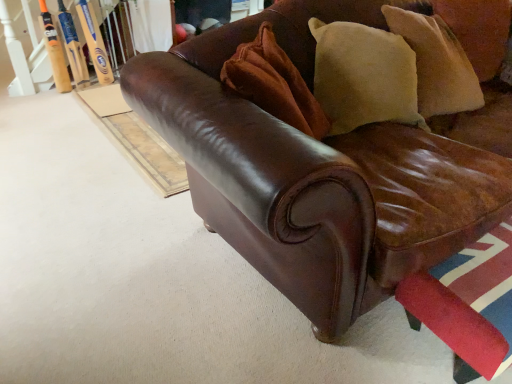
This screenshot has width=512, height=384. What do you see at coordinates (315, 173) in the screenshot?
I see `brown leather couch at center` at bounding box center [315, 173].

What is the approximate width of wooden baseball bat at upper left, the 2th baseball bat when ordered from left to right?

wooden baseball bat at upper left, the 2th baseball bat when ordered from left to right, is 5.60 inches wide.

What is the approximate height of orange wood baseball bat at upper left, the first baseball bat when ordered from left to right?

It is 26.14 inches.

The height and width of the screenshot is (384, 512). Describe the element at coordinates (55, 51) in the screenshot. I see `orange wood baseball bat at upper left, the first baseball bat when ordered from left to right` at that location.

You are a GUI agent. You are given a task and a screenshot of the screen. Output one action in this format:
    pyautogui.click(x=<x>, y=<y>)
    Task: Click on the brown leather couch at center
    Image resolution: width=512 pixels, height=384 pixels.
    Given the screenshot: What is the action you would take?
    pyautogui.click(x=315, y=173)

Is velvet beige pillow at upper right, placed as the second pillow when sorted from back to front, not close to brown leather couch at center?

velvet beige pillow at upper right, placed as the second pillow when sorted from back to front, is near brown leather couch at center, not far away.

Choose the correct answer: Is velvet beige pillow at upper right, marked as the second pillow in a right-to-left arrangement, inside brown leather couch at center or outside it?

velvet beige pillow at upper right, marked as the second pillow in a right-to-left arrangement, can be found inside brown leather couch at center.

Considering the positions of points (319, 115) and (386, 150), is point (319, 115) closer to camera compared to point (386, 150)?

No, (319, 115) is behind (386, 150).

From a real-world perspective, which object rests below the other?

From a 3D spatial view, brown leather couch at center is below.

Considering the sizes of objects rubberized red swivel chair at lower right and beige suede pillow at upper right, the second pillow when ordered from left to right, in the image provided, who is shorter, rubberized red swivel chair at lower right or beige suede pillow at upper right, the second pillow when ordered from left to right,?

Standing shorter between the two is rubberized red swivel chair at lower right.

Considering the relative positions of rubberized red swivel chair at lower right and beige suede pillow at upper right, the second pillow when ordered from left to right, in the image provided, is rubberized red swivel chair at lower right to the right of beige suede pillow at upper right, the second pillow when ordered from left to right, from the viewer's perspective?

No, rubberized red swivel chair at lower right is not to the right of beige suede pillow at upper right, the second pillow when ordered from left to right.

Does rubberized red swivel chair at lower right touch beige suede pillow at upper right, the second pillow when ordered from left to right?

No, rubberized red swivel chair at lower right is not next to beige suede pillow at upper right, the second pillow when ordered from left to right.

Is rubberized red swivel chair at lower right positioned beyond the bounds of beige suede pillow at upper right, which ranks as the 2th pillow in front-to-back order?

Absolutely, rubberized red swivel chair at lower right is external to beige suede pillow at upper right, which ranks as the 2th pillow in front-to-back order.

Does velvet beige pillow at upper right, placed as the second pillow when sorted from back to front, contain wooden baseball bat at upper left, the 2th baseball bat when ordered from left to right?

That's incorrect, wooden baseball bat at upper left, the 2th baseball bat when ordered from left to right, is not inside velvet beige pillow at upper right, placed as the second pillow when sorted from back to front.

Can you confirm if velvet beige pillow at upper right, placed as the second pillow when sorted from back to front, is bigger than wooden baseball bat at upper left, which is the first baseball bat from right to left?

Indeed, velvet beige pillow at upper right, placed as the second pillow when sorted from back to front, has a larger size compared to wooden baseball bat at upper left, which is the first baseball bat from right to left.

Is point (311, 100) behind point (82, 9)?

No, it is not.

Measure the distance from velvet beige pillow at upper right, arranged as the 1th pillow when viewed from the left, to wooden baseball bat at upper left, which is the first baseball bat from right to left.

velvet beige pillow at upper right, arranged as the 1th pillow when viewed from the left, and wooden baseball bat at upper left, which is the first baseball bat from right to left, are 6.95 feet apart from each other.

Who is smaller, wooden baseball bat at upper left, which is the first baseball bat from right to left, or velvet beige pillow at upper right, marked as the second pillow in a right-to-left arrangement?

wooden baseball bat at upper left, which is the first baseball bat from right to left, is smaller.

Which object is positioned more to the left, wooden baseball bat at upper left, the 2th baseball bat when ordered from left to right, or velvet beige pillow at upper right, placed as the second pillow when sorted from back to front?

Positioned to the left is wooden baseball bat at upper left, the 2th baseball bat when ordered from left to right.

Does wooden baseball bat at upper left, the 2th baseball bat when ordered from left to right, have a greater height compared to velvet beige pillow at upper right, marked as the second pillow in a right-to-left arrangement?

Yes.

Which object is further away from the camera taking this photo, wooden baseball bat at upper left, which is the first baseball bat from right to left, or velvet beige pillow at upper right, the 1th pillow when ordered from front to back?

Positioned behind is wooden baseball bat at upper left, which is the first baseball bat from right to left.

Considering the relative sizes of brown leather couch at center and rubberized red swivel chair at lower right in the image provided, is brown leather couch at center bigger than rubberized red swivel chair at lower right?

Yes.

This screenshot has width=512, height=384. Identify the location of swivel chair located behind the brown leather couch at center. (468, 304).

Which of these two, brown leather couch at center or rubberized red swivel chair at lower right, is thinner?

With smaller width is rubberized red swivel chair at lower right.

Based on the photo, how much distance is there between rubberized red swivel chair at lower right and orange wood baseball bat at upper left, the first baseball bat when ordered from left to right?

The distance of rubberized red swivel chair at lower right from orange wood baseball bat at upper left, the first baseball bat when ordered from left to right, is 9.52 feet.

From a real-world perspective, is rubberized red swivel chair at lower right physically located above or below orange wood baseball bat at upper left, the first baseball bat when ordered from left to right?

rubberized red swivel chair at lower right is below orange wood baseball bat at upper left, the first baseball bat when ordered from left to right.

Is rubberized red swivel chair at lower right positioned before orange wood baseball bat at upper left, the 2th baseball bat from the right?

Yes.

Between orange wood baseball bat at upper left, the first baseball bat when ordered from left to right, and rubberized red swivel chair at lower right, which one appears on the right side from the viewer's perspective?

rubberized red swivel chair at lower right.

In the scene shown: Can you confirm if orange wood baseball bat at upper left, the 2th baseball bat from the right, is shorter than rubberized red swivel chair at lower right?

Incorrect, the height of orange wood baseball bat at upper left, the 2th baseball bat from the right, does not fall short of that of rubberized red swivel chair at lower right.

Considering the sizes of orange wood baseball bat at upper left, the first baseball bat when ordered from left to right, and rubberized red swivel chair at lower right in the image, is orange wood baseball bat at upper left, the first baseball bat when ordered from left to right, wider or thinner than rubberized red swivel chair at lower right?

In the image, orange wood baseball bat at upper left, the first baseball bat when ordered from left to right, appears to be more narrow than rubberized red swivel chair at lower right.

Where is `swivel chair that appears in front of the orange wood baseball bat at upper left, the first baseball bat when ordered from left to right`? Image resolution: width=512 pixels, height=384 pixels. swivel chair that appears in front of the orange wood baseball bat at upper left, the first baseball bat when ordered from left to right is located at coordinates (468, 304).

Locate an element on the screen. The image size is (512, 384). studio couch above the velvet beige pillow at upper right, arranged as the 1th pillow when viewed from the left (from the image's perspective) is located at coordinates (315, 173).

Where is `swivel chair located in front of the beige suede pillow at upper right, which appears as the 1th pillow when viewed from the back`? The height and width of the screenshot is (384, 512). swivel chair located in front of the beige suede pillow at upper right, which appears as the 1th pillow when viewed from the back is located at coordinates (468, 304).

Looking at the image, which one is located further to wooden baseball bat at upper left, which is the first baseball bat from right to left, rubberized red swivel chair at lower right or beige suede pillow at upper right, the second pillow when ordered from left to right?

rubberized red swivel chair at lower right lies further to wooden baseball bat at upper left, which is the first baseball bat from right to left, than the other object.

Based on their spatial positions, is rubberized red swivel chair at lower right or wooden baseball bat at upper left, which is the first baseball bat from right to left, closer to brown leather couch at center?

Based on the image, rubberized red swivel chair at lower right appears to be nearer to brown leather couch at center.

Looking at the image, which one is located closer to beige suede pillow at upper right, positioned as the first pillow in right-to-left order, rubberized red swivel chair at lower right or brown leather couch at center?

brown leather couch at center is positioned closer to the anchor beige suede pillow at upper right, positioned as the first pillow in right-to-left order.

Estimate the real-world distances between objects in this image. Which object is further from rubberized red swivel chair at lower right, velvet beige pillow at upper right, placed as the second pillow when sorted from back to front, or wooden baseball bat at upper left, which is the first baseball bat from right to left?

The object further to rubberized red swivel chair at lower right is wooden baseball bat at upper left, which is the first baseball bat from right to left.

When comparing their distances from beige suede pillow at upper right, positioned as the first pillow in right-to-left order, does orange wood baseball bat at upper left, the first baseball bat when ordered from left to right, or rubberized red swivel chair at lower right seem further?

orange wood baseball bat at upper left, the first baseball bat when ordered from left to right, lies further to beige suede pillow at upper right, positioned as the first pillow in right-to-left order, than the other object.

Which object lies nearer to the anchor point rubberized red swivel chair at lower right, beige suede pillow at upper right, positioned as the first pillow in right-to-left order, or brown leather couch at center?

The object closer to rubberized red swivel chair at lower right is brown leather couch at center.

Based on their spatial positions, is orange wood baseball bat at upper left, the first baseball bat when ordered from left to right, or brown leather couch at center further from velvet beige pillow at upper right, marked as the second pillow in a right-to-left arrangement?

Based on the image, orange wood baseball bat at upper left, the first baseball bat when ordered from left to right, appears to be further to velvet beige pillow at upper right, marked as the second pillow in a right-to-left arrangement.

Considering their positions, is brown leather couch at center positioned closer to velvet beige pillow at upper right, the 1th pillow when ordered from front to back, than rubberized red swivel chair at lower right?

brown leather couch at center is positioned closer to the anchor velvet beige pillow at upper right, the 1th pillow when ordered from front to back.

The height and width of the screenshot is (384, 512). Identify the location of baseball bat between velvet beige pillow at upper right, marked as the second pillow in a right-to-left arrangement, and wooden baseball bat at upper left, which is the first baseball bat from right to left, from front to back. (55, 51).

In order to click on swivel chair between brown leather couch at center and beige suede pillow at upper right, which ranks as the 2th pillow in front-to-back order, in the front-back direction in this screenshot , I will do `click(468, 304)`.

Locate an element on the screen. Image resolution: width=512 pixels, height=384 pixels. pillow between orange wood baseball bat at upper left, the first baseball bat when ordered from left to right, and rubberized red swivel chair at lower right from left to right is located at coordinates (274, 84).

At what (x,y) coordinates should I click in order to perform the action: click on baseball bat situated between orange wood baseball bat at upper left, the 2th baseball bat from the right, and rubberized red swivel chair at lower right from left to right. Please return your answer as a coordinate pair (x, y). Looking at the image, I should click on (94, 42).